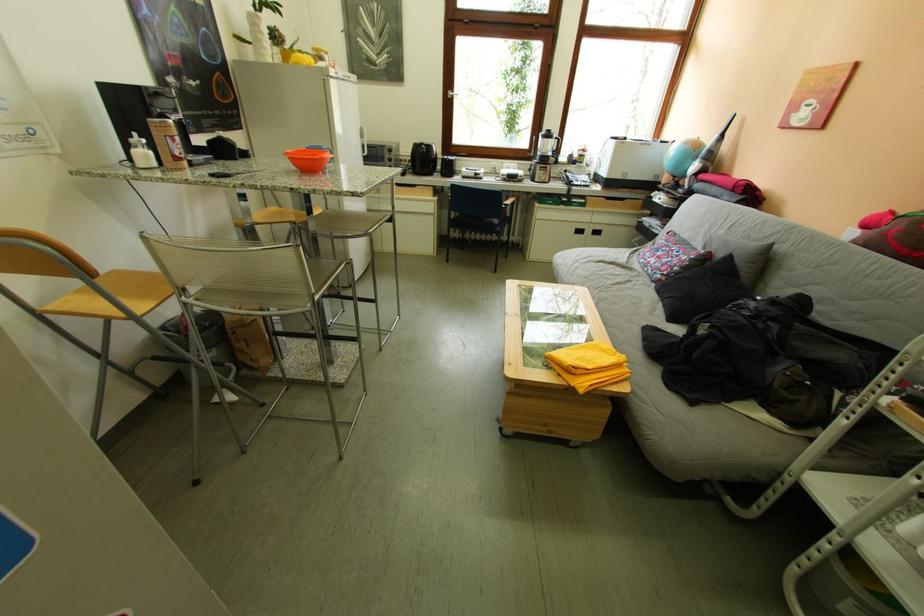
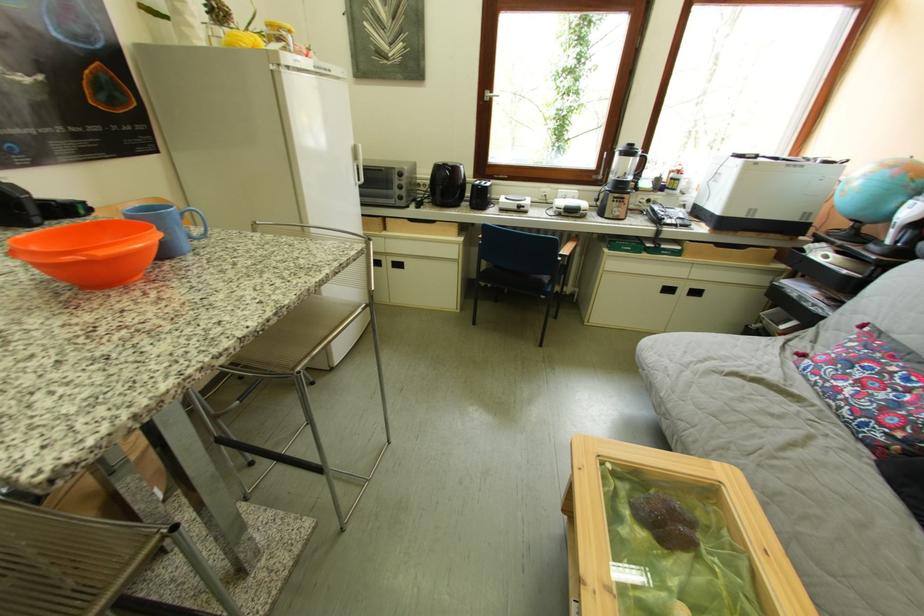
Find the pixel in the second image that matches the point at 601,235 in the first image.

(695, 294)